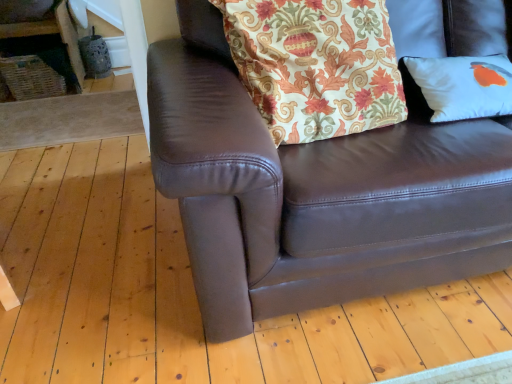
Question: Is floral fabric pillow at upper center at the right side of brown leather couch at center?

Choices:
 (A) no
 (B) yes

Answer: (A)

Question: Considering the relative positions of floral fabric pillow at upper center and brown leather couch at center in the image provided, is floral fabric pillow at upper center in front of brown leather couch at center?

Choices:
 (A) yes
 (B) no

Answer: (B)

Question: Does floral fabric pillow at upper center have a smaller size compared to brown leather couch at center?

Choices:
 (A) yes
 (B) no

Answer: (A)

Question: From a real-world perspective, is floral fabric pillow at upper center physically above brown leather couch at center?

Choices:
 (A) yes
 (B) no

Answer: (A)

Question: From the image's perspective, is floral fabric pillow at upper center on top of brown leather couch at center?

Choices:
 (A) yes
 (B) no

Answer: (A)

Question: Based on their positions, is white matte pillow at right located to the left or right of brown leather couch at center?

Choices:
 (A) right
 (B) left

Answer: (A)

Question: Is white matte pillow at right spatially inside brown leather couch at center, or outside of it?

Choices:
 (A) inside
 (B) outside

Answer: (A)

Question: From their relative heights in the image, would you say white matte pillow at right is taller or shorter than brown leather couch at center?

Choices:
 (A) tall
 (B) short

Answer: (B)

Question: From the image's perspective, relative to brown leather couch at center, is white matte pillow at right above or below?

Choices:
 (A) above
 (B) below

Answer: (A)

Question: Is brown leather couch at center in front of or behind white matte pillow at right in the image?

Choices:
 (A) front
 (B) behind

Answer: (A)

Question: Is brown leather couch at center inside or outside of white matte pillow at right?

Choices:
 (A) outside
 (B) inside

Answer: (A)

Question: Is brown leather couch at center bigger or smaller than white matte pillow at right?

Choices:
 (A) small
 (B) big

Answer: (B)

Question: Considering the positions of brown leather couch at center and white matte pillow at right in the image, is brown leather couch at center taller or shorter than white matte pillow at right?

Choices:
 (A) tall
 (B) short

Answer: (A)

Question: Does point (367, 54) appear closer or farther from the camera than point (464, 96)?

Choices:
 (A) closer
 (B) farther

Answer: (A)

Question: Based on their sizes in the image, would you say floral fabric pillow at upper center is bigger or smaller than white matte pillow at right?

Choices:
 (A) big
 (B) small

Answer: (A)